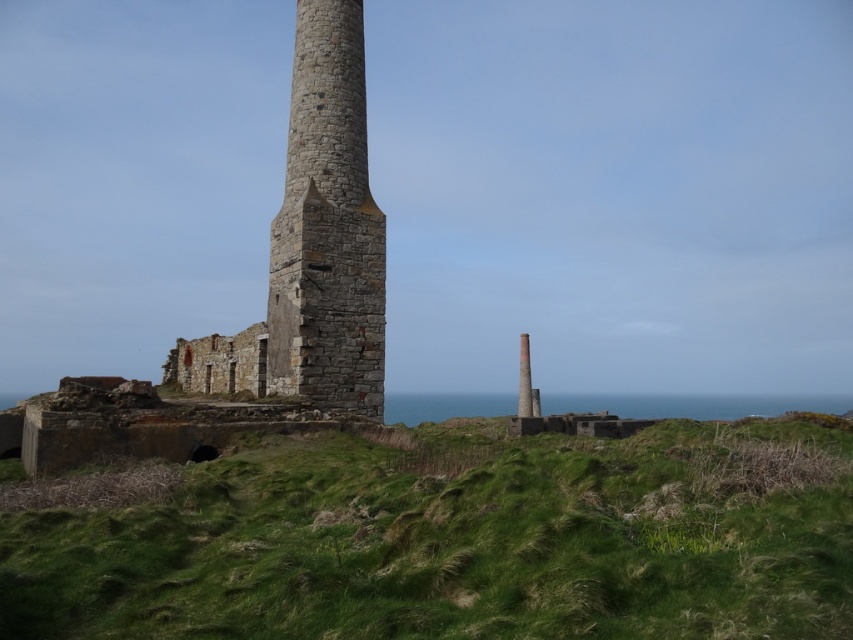
Does green grassy at center have a greater width compared to rustic stone tower at center?

Yes, green grassy at center is wider than rustic stone tower at center.

Where is `green grassy at center`? The image size is (853, 640). green grassy at center is located at coordinates (445, 540).